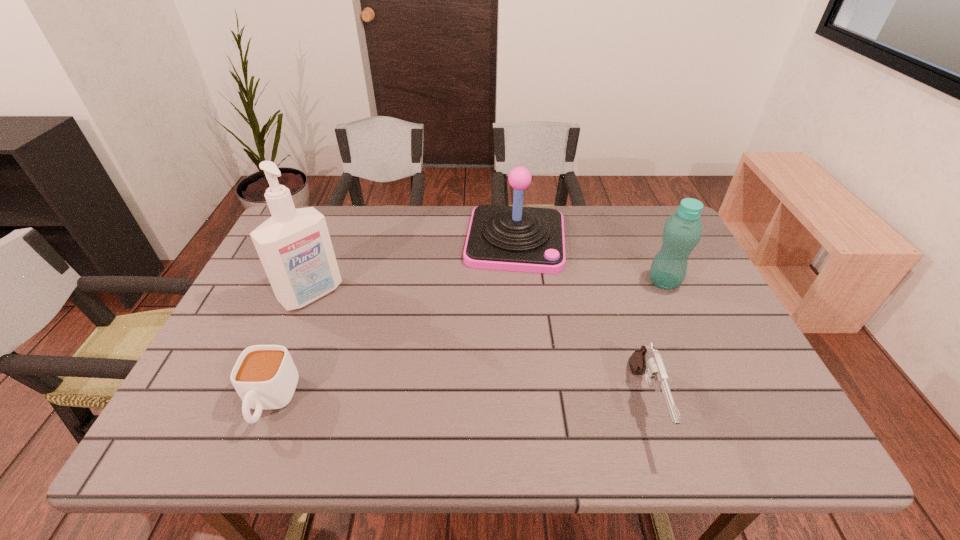
The width and height of the screenshot is (960, 540). I want to click on object positioned at the right edge, so click(x=682, y=231).

Image resolution: width=960 pixels, height=540 pixels. Identify the location of object that is at the near left corner. (265, 377).

Image resolution: width=960 pixels, height=540 pixels. In order to click on vacant space at the far edge of the desktop in this screenshot , I will do `click(386, 241)`.

Where is `vacant area at the near edge of the desktop`? vacant area at the near edge of the desktop is located at coordinates (315, 396).

Identify the location of free region at the left edge. Image resolution: width=960 pixels, height=540 pixels. (267, 282).

The height and width of the screenshot is (540, 960). Find the location of `free space at the right edge of the desktop`. free space at the right edge of the desktop is located at coordinates (685, 302).

Image resolution: width=960 pixels, height=540 pixels. Identify the location of free space that is in between the water bottle and the fourth object from left to right. (655, 343).

You are a GUI agent. You are given a task and a screenshot of the screen. Output one action in this format:
    pyautogui.click(x=<x>, y=<y>)
    Task: Click on the vacant space that is in between the joystick and the water bottle
    The image size is (960, 540).
    Given the screenshot: What is the action you would take?
    pyautogui.click(x=589, y=261)

Find the location of a particular element. vacant space that is in between the fourth tallest object and the cleansing agent is located at coordinates (479, 349).

Find the location of `free point between the fourth object from left to right and the cup`. free point between the fourth object from left to right and the cup is located at coordinates (458, 403).